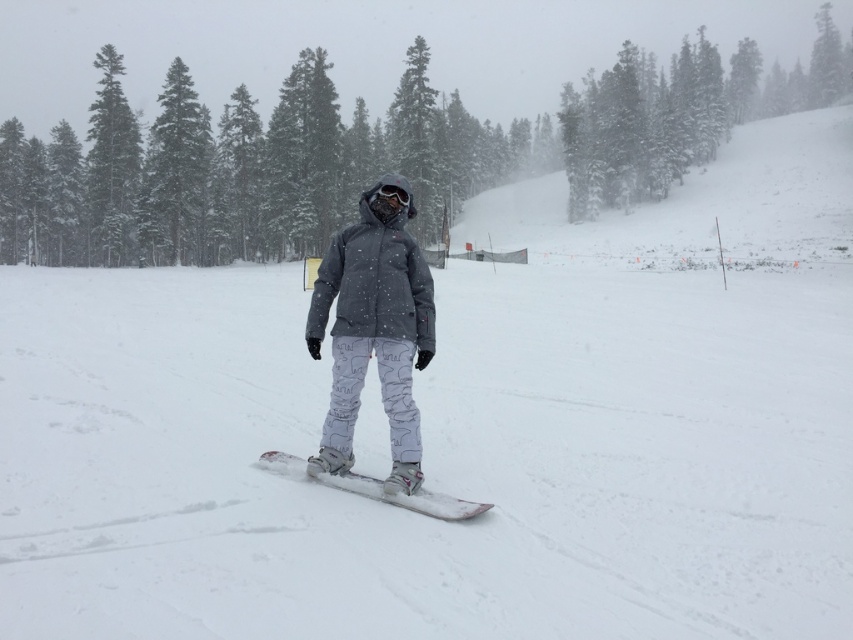
Between green matte tree at center and gray matte jacket at center, which one appears on the left side from the viewer's perspective?

Positioned to the left is green matte tree at center.

Can you confirm if green matte tree at center is bigger than gray matte jacket at center?

Correct, green matte tree at center is larger in size than gray matte jacket at center.

The height and width of the screenshot is (640, 853). In order to click on green matte tree at center in this screenshot , I will do `click(369, 150)`.

Does gray matte jacket at center have a lesser height compared to white matte snowboard at center?

In fact, gray matte jacket at center may be taller than white matte snowboard at center.

Is gray matte jacket at center smaller than white matte snowboard at center?

No.

Is point (346, 289) behind point (485, 508)?

Yes, it is.

Where is `gray matte jacket at center`? gray matte jacket at center is located at coordinates (375, 352).

Is the position of green matte tree at center less distant than that of matte black goggles at center?

That is False.

Measure the distance from green matte tree at center to matte black goggles at center.

The distance of green matte tree at center from matte black goggles at center is 152.09 meters.

This screenshot has height=640, width=853. What are the coordinates of `green matte tree at center` in the screenshot? It's located at (369, 150).